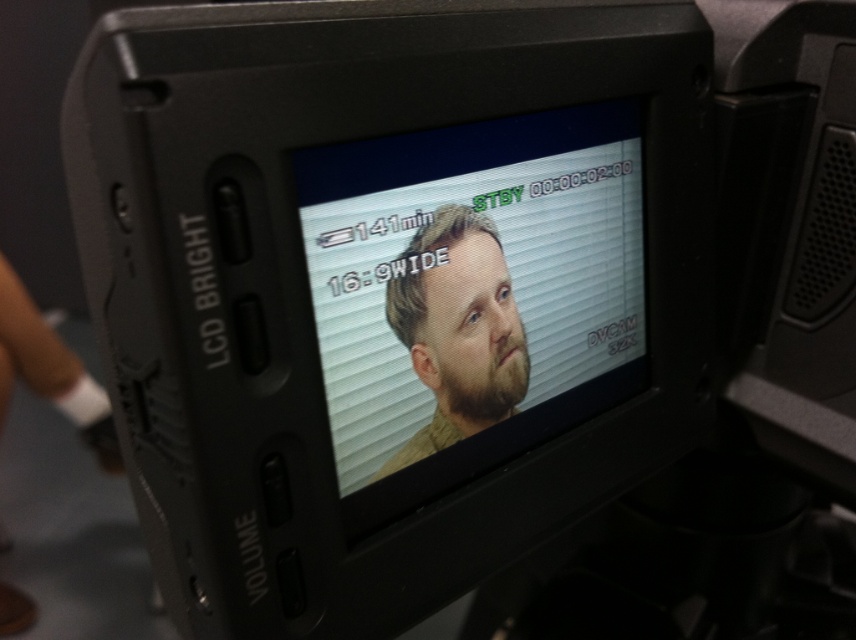
Question: Among these points, which one is nearest to the camera?

Choices:
 (A) (503, 403)
 (B) (474, 342)

Answer: (B)

Question: In this image, where is matte black monitor at center located relative to beige fabric face at center?

Choices:
 (A) left
 (B) right

Answer: (B)

Question: Which point appears closest to the camera in this image?

Choices:
 (A) (456, 289)
 (B) (340, 406)

Answer: (B)

Question: Which point appears farthest from the camera in this image?

Choices:
 (A) (556, 122)
 (B) (411, 246)

Answer: (A)

Question: Can you confirm if matte black monitor at center is thinner than beige fabric face at center?

Choices:
 (A) no
 (B) yes

Answer: (A)

Question: Where is matte black monitor at center located in relation to beige fabric face at center in the image?

Choices:
 (A) left
 (B) right

Answer: (B)